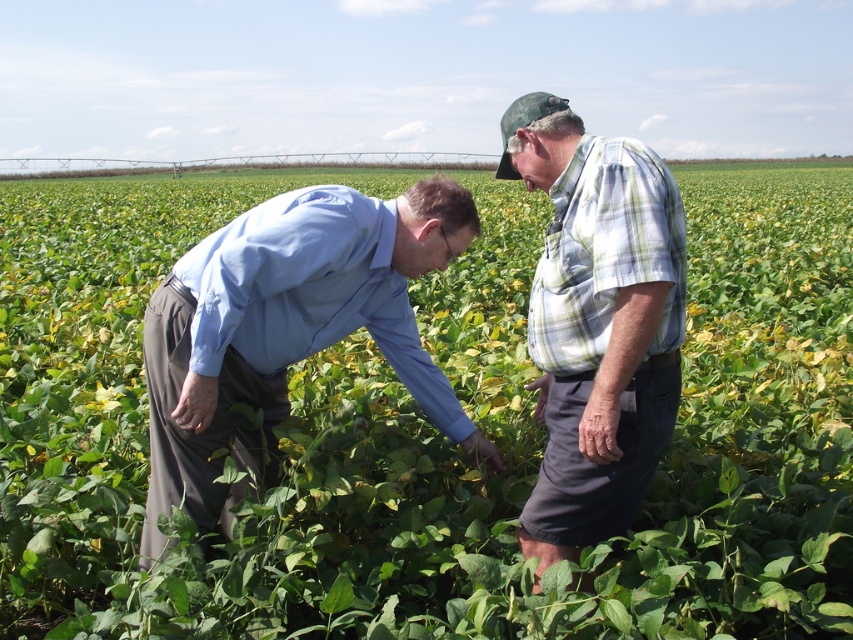
Question: Among these objects, which one is nearest to the camera?

Choices:
 (A) light blue shirt at center
 (B) plaid shirt at center

Answer: (B)

Question: Does light blue shirt at center appear on the right side of plaid shirt at center?

Choices:
 (A) no
 (B) yes

Answer: (A)

Question: Can you confirm if light blue shirt at center is positioned to the left of plaid shirt at center?

Choices:
 (A) yes
 (B) no

Answer: (A)

Question: Is light blue shirt at center above plaid shirt at center?

Choices:
 (A) yes
 (B) no

Answer: (B)